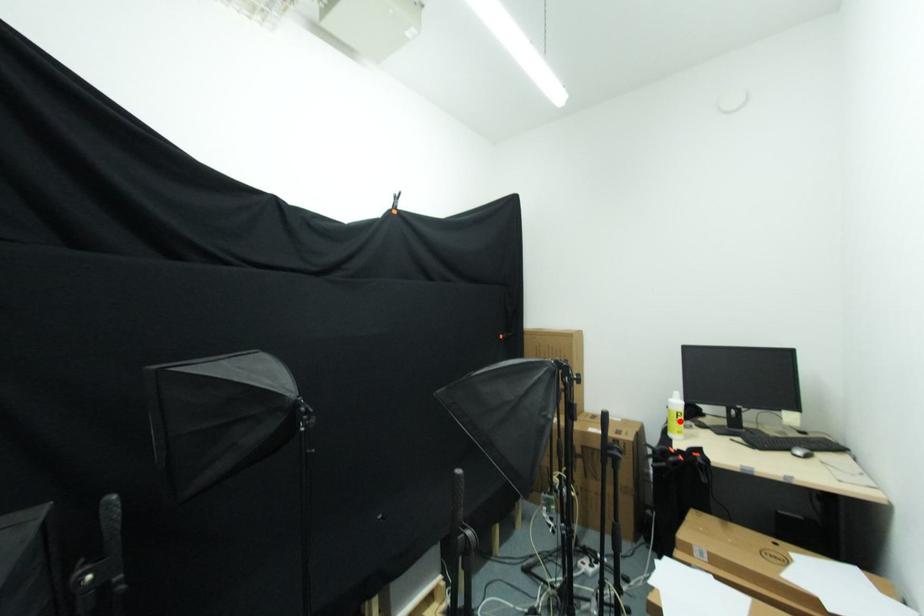
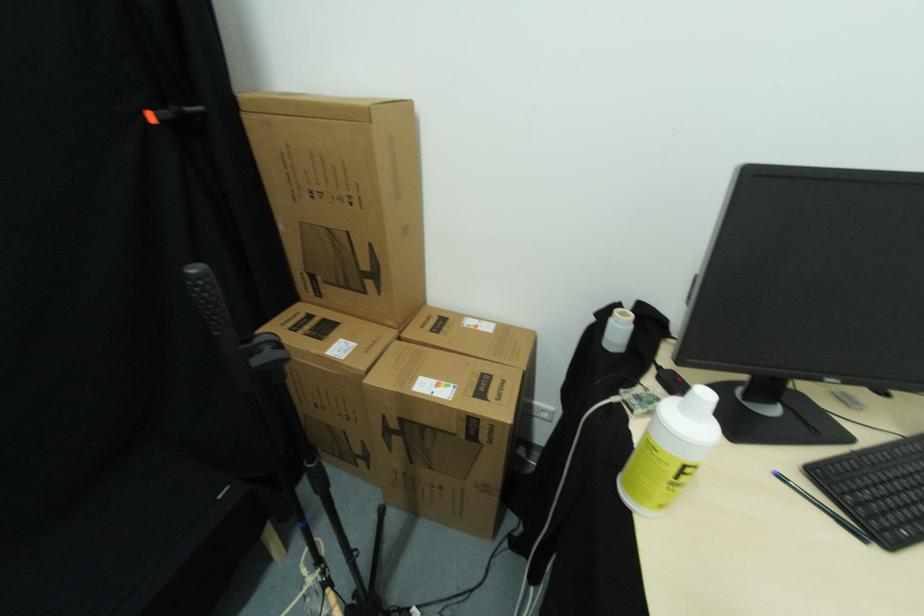
Find the pixel in the second image that matches the highlighted location in the first image.

(678, 480)